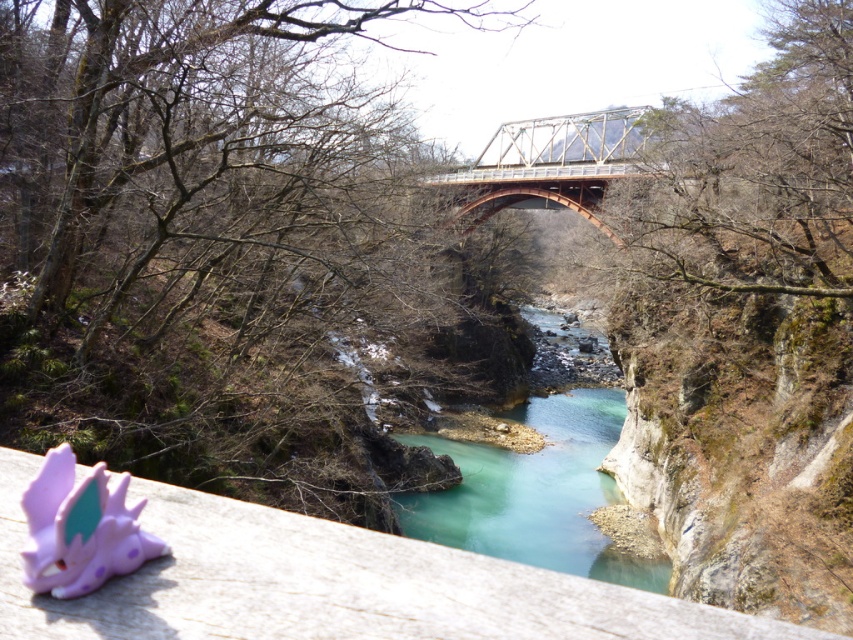
Does purple plastic toy at lower left have a smaller size compared to turquoise smooth water at center?

Indeed, purple plastic toy at lower left has a smaller size compared to turquoise smooth water at center.

Describe the element at coordinates (329, 582) in the screenshot. I see `purple plastic toy at lower left` at that location.

Is point (340, 628) farther from viewer compared to point (567, 419)?

No, (340, 628) is closer to viewer.

You are a GUI agent. You are given a task and a screenshot of the screen. Output one action in this format:
    pyautogui.click(x=<x>, y=<y>)
    Task: Click on the purple plastic toy at lower left
    The image size is (853, 640).
    Given the screenshot: What is the action you would take?
    pyautogui.click(x=329, y=582)

Does turquoise smooth water at center appear on the right side of metallic orange bridge at center?

Indeed, turquoise smooth water at center is positioned on the right side of metallic orange bridge at center.

You are a GUI agent. You are given a task and a screenshot of the screen. Output one action in this format:
    pyautogui.click(x=<x>, y=<y>)
    Task: Click on the turquoise smooth water at center
    
    Given the screenshot: What is the action you would take?
    pyautogui.click(x=535, y=492)

I want to click on turquoise smooth water at center, so click(535, 492).

Can you confirm if purple plastic toy at lower left is smaller than metallic orange bridge at center?

Correct, purple plastic toy at lower left occupies less space than metallic orange bridge at center.

Can you confirm if purple plastic toy at lower left is positioned to the left of metallic orange bridge at center?

Indeed, purple plastic toy at lower left is positioned on the left side of metallic orange bridge at center.

Is point (33, 630) farther from viewer compared to point (515, 172)?

No, (33, 630) is in front of (515, 172).

You are a GUI agent. You are given a task and a screenshot of the screen. Output one action in this format:
    pyautogui.click(x=<x>, y=<y>)
    Task: Click on the purple plastic toy at lower left
    The image size is (853, 640).
    Given the screenshot: What is the action you would take?
    pyautogui.click(x=329, y=582)